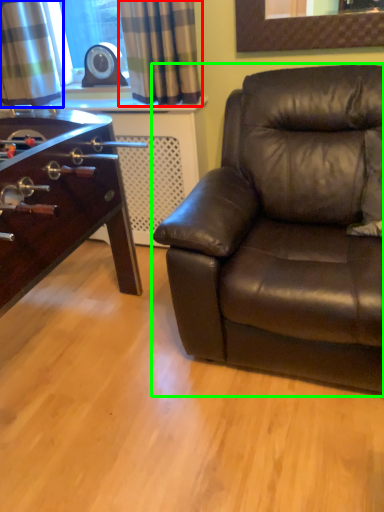
Question: Estimate the real-world distances between objects in this image. Which object is farther from curtain (highlighted by a red box), curtain (highlighted by a blue box) or studio couch (highlighted by a green box)?

Choices:
 (A) curtain
 (B) studio couch

Answer: (B)